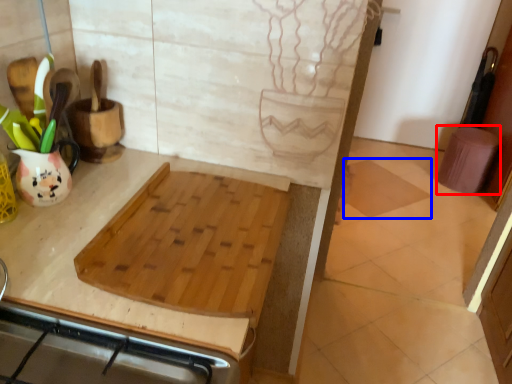
Question: Among these objects, which one is nearest to the camera, step stool (highlighted by a red box) or tile (highlighted by a blue box)?

Choices:
 (A) step stool
 (B) tile

Answer: (B)